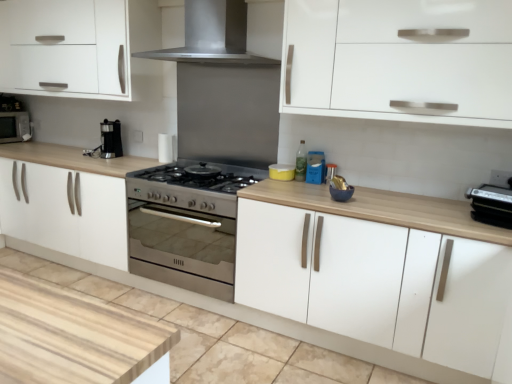
Question: Does matte black microwave at left have a smaller size compared to metallic silver toaster at center, which ranks as the 2th appliance in back-to-front order?

Choices:
 (A) no
 (B) yes

Answer: (A)

Question: Is matte black microwave at left bigger than metallic silver toaster at center, which ranks as the 2th appliance in back-to-front order?

Choices:
 (A) no
 (B) yes

Answer: (B)

Question: Is matte black microwave at left aimed at metallic silver toaster at center, marked as the second appliance in a front-to-back arrangement?

Choices:
 (A) yes
 (B) no

Answer: (A)

Question: Can you confirm if matte black microwave at left is wider than metallic silver toaster at center, marked as the second appliance in a front-to-back arrangement?

Choices:
 (A) yes
 (B) no

Answer: (A)

Question: Is matte black microwave at left behind metallic silver toaster at center, which is the second appliance from left to right?

Choices:
 (A) yes
 (B) no

Answer: (A)

Question: Considering the relative positions of metallic silver toaster at center, which ranks as the 2th appliance in back-to-front order, and yellow matte container at center, which is the 1th appliance from back to front, in the image provided, is metallic silver toaster at center, which ranks as the 2th appliance in back-to-front order, to the left or to the right of yellow matte container at center, which is the 1th appliance from back to front,?

Choices:
 (A) left
 (B) right

Answer: (B)

Question: Would you say metallic silver toaster at center, the 2th appliance positioned from the right, is inside or outside yellow matte container at center, the 3th appliance positioned from the front?

Choices:
 (A) inside
 (B) outside

Answer: (B)

Question: Looking at their shapes, would you say metallic silver toaster at center, which ranks as the 2th appliance in back-to-front order, is wider or thinner than yellow matte container at center, the 3th appliance positioned from the front?

Choices:
 (A) wide
 (B) thin

Answer: (B)

Question: From a real-world perspective, is metallic silver toaster at center, marked as the second appliance in a front-to-back arrangement, physically located above or below yellow matte container at center, marked as the 1th appliance in a left-to-right arrangement?

Choices:
 (A) below
 (B) above

Answer: (B)

Question: Relative to white matte cabinet at lower center, the 1th cabinetry from the left, is matte black microwave at left in front or behind?

Choices:
 (A) behind
 (B) front

Answer: (A)

Question: From a real-world perspective, relative to white matte cabinet at lower center, arranged as the 2th cabinetry when viewed from the right, is matte black microwave at left vertically above or below?

Choices:
 (A) below
 (B) above

Answer: (B)

Question: In terms of width, does matte black microwave at left look wider or thinner when compared to white matte cabinet at lower center, the 1th cabinetry from the left?

Choices:
 (A) thin
 (B) wide

Answer: (A)

Question: From the image's perspective, is matte black microwave at left above or below white matte cabinet at lower center, the 1th cabinetry from the left?

Choices:
 (A) above
 (B) below

Answer: (A)

Question: From a real-world perspective, is yellow matte container at center, which is the 1th appliance from back to front, physically located above or below stainless steel range hood at upper center?

Choices:
 (A) below
 (B) above

Answer: (A)

Question: From the image's perspective, relative to stainless steel range hood at upper center, is yellow matte container at center, which is the 1th appliance from back to front, above or below?

Choices:
 (A) above
 (B) below

Answer: (B)